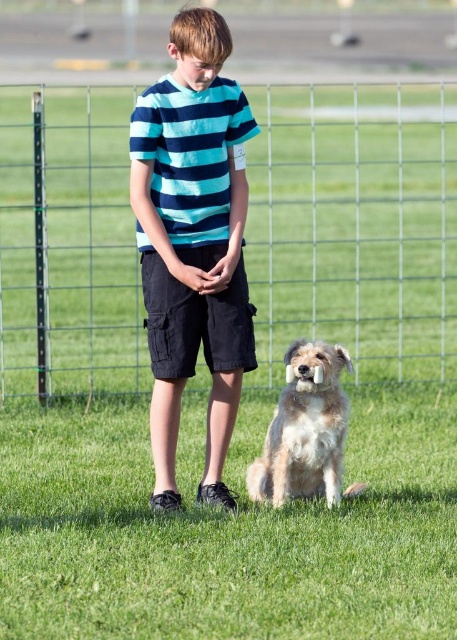
Which is in front, point (383, 275) or point (217, 396)?

Point (217, 396)

In the scene shown: Is wire mesh fence at center positioned behind striped cotton shirt at center?

That is True.

What do you see at coordinates (355, 225) in the screenshot?
I see `wire mesh fence at center` at bounding box center [355, 225].

The width and height of the screenshot is (457, 640). I want to click on wire mesh fence at center, so [355, 225].

Which is above, green grass at lower center or fuzzy beige dog at lower center?

fuzzy beige dog at lower center is higher up.

Between point (153, 579) and point (248, 476), which one is positioned behind?

Positioned behind is point (248, 476).

Does point (42, 448) come farther from viewer compared to point (277, 424)?

Yes, it is behind point (277, 424).

Where is `green grass at lower center`? green grass at lower center is located at coordinates (227, 531).

Which is more to the right, striped cotton shirt at center or striped cotton t-shirt at center?

Positioned to the right is striped cotton t-shirt at center.

Find the location of `striped cotton shirt at center`. striped cotton shirt at center is located at coordinates (192, 243).

I want to click on striped cotton shirt at center, so click(192, 243).